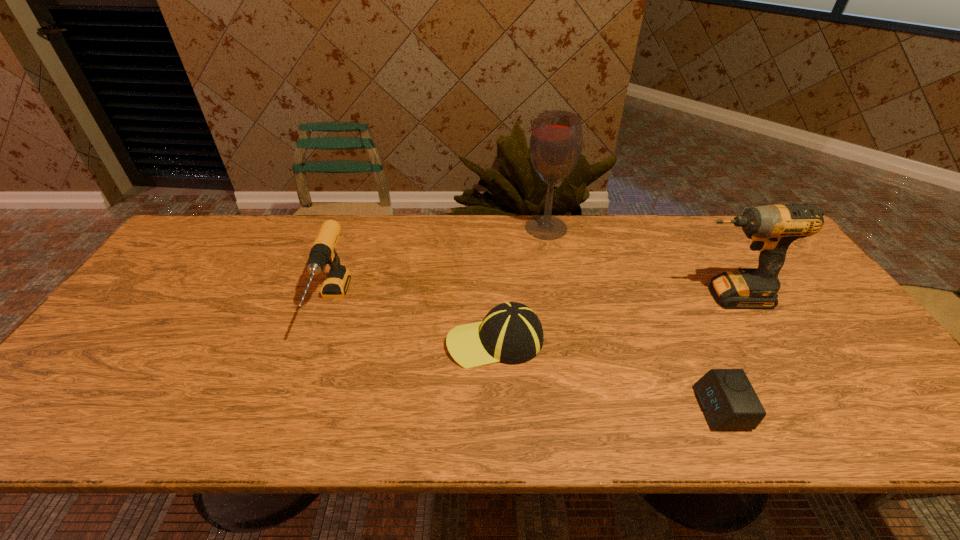
Find the location of a particular element. vacant space located with the drill bit of the fourth shortest object facing forward is located at coordinates (641, 296).

What are the coordinates of `free space located 0.320m with the drill bit of the fourth shortest object facing forward` in the screenshot? It's located at (569, 296).

Identify the location of vacant space located 0.070m with the drill bit of the fourth shortest object facing forward. The width and height of the screenshot is (960, 540). (660, 296).

Find the location of `vacant space located 0.120m on the handle side of the third tallest object`. vacant space located 0.120m on the handle side of the third tallest object is located at coordinates (301, 392).

Where is `free space located 0.310m with the brim of the second shortest object facing forward`? free space located 0.310m with the brim of the second shortest object facing forward is located at coordinates (324, 341).

Locate an element on the screen. This screenshot has width=960, height=540. vacant region located 0.230m with the brim of the second shortest object facing forward is located at coordinates (355, 341).

Where is `vacant space located 0.340m with the brim of the second shortest object facing forward`? This screenshot has height=540, width=960. vacant space located 0.340m with the brim of the second shortest object facing forward is located at coordinates (311, 341).

Image resolution: width=960 pixels, height=540 pixels. What are the coordinates of `free space located on the front-facing side of the nearest object` in the screenshot? It's located at (673, 408).

I want to click on vacant space located 0.290m on the front-facing side of the nearest object, so click(x=568, y=408).

Locate an element on the screen. free space located on the front-facing side of the nearest object is located at coordinates (610, 408).